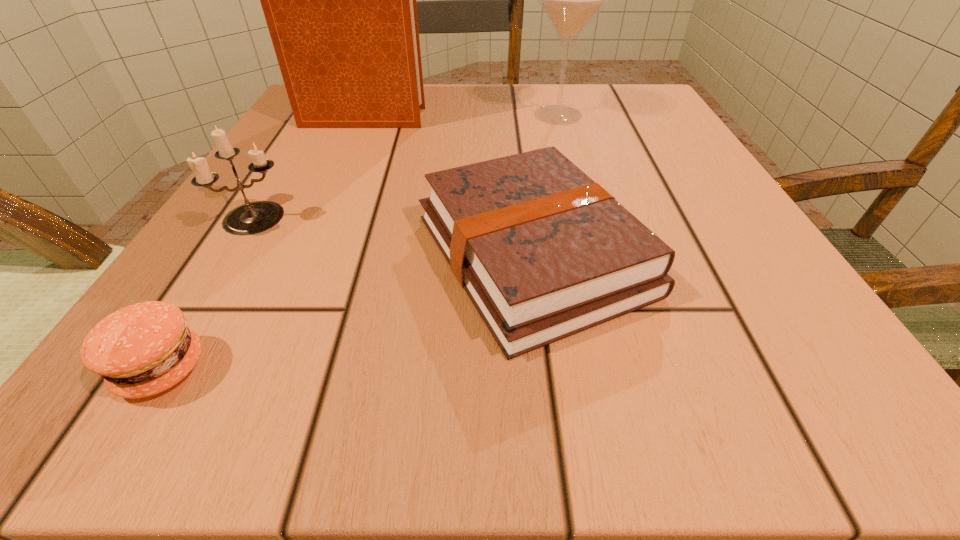
Locate an element on the screen. free space that satisfies the following two spatial constraints: 1. on the open cover of the nearer hardback book; 2. on the left side of the taller hardback book is located at coordinates (300, 254).

What are the coordinates of `free region that satisfies the following two spatial constraints: 1. on the open cover of the taller hardback book; 2. on the left side of the nearer hardback book` in the screenshot? It's located at (300, 254).